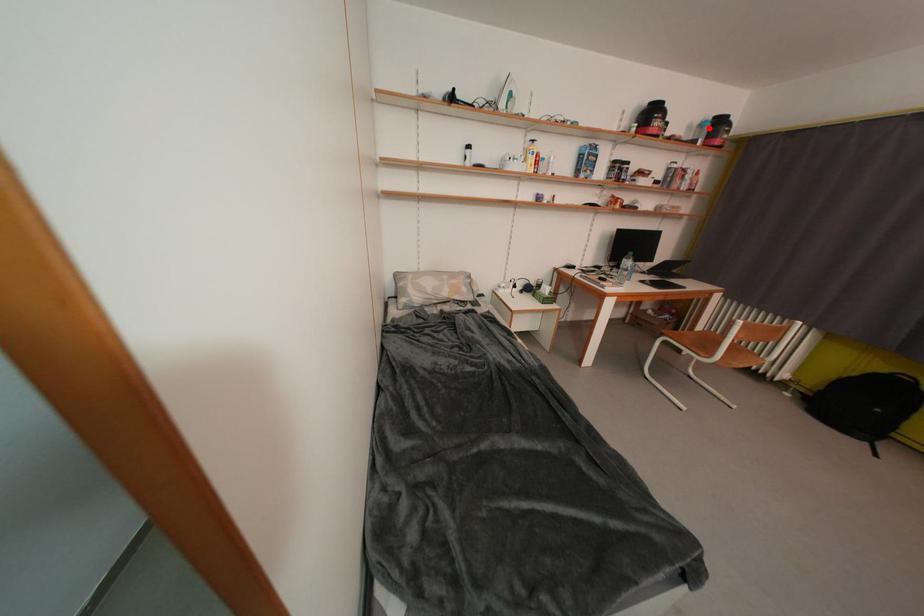
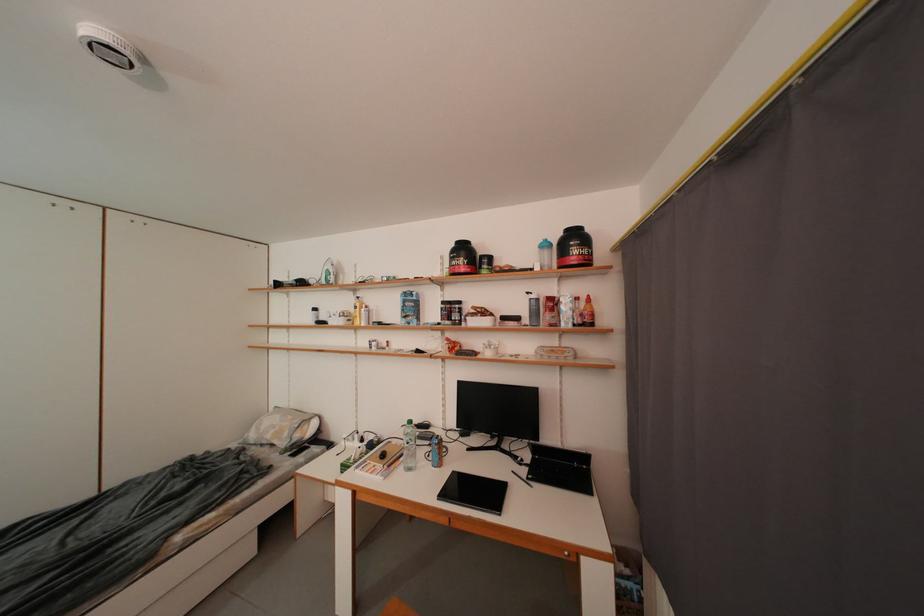
Where in the second image is the point corresponding to the highlighted location from the first image?

(553, 249)